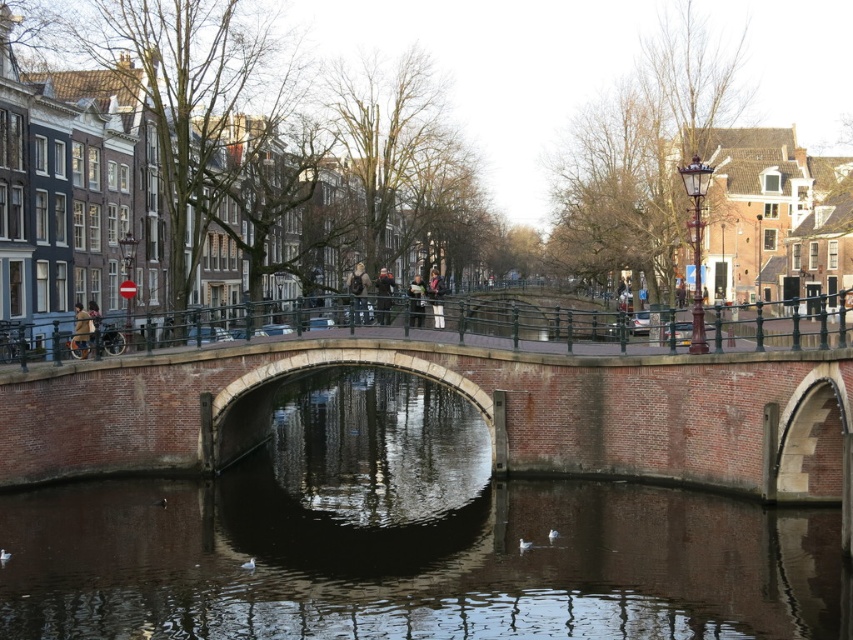
You are a tourist standing on the brick stone bridge at center and want to take a photo of the green metal railing at center. Which object should you focus on first if you want to include both in your photo without moving your camera?

Since the brick stone bridge at center is smaller in size compared to the green metal railing at center, you should focus on the brick stone bridge at center first to ensure it fits within the frame before adjusting for the larger railing.

You are standing at the center of the brick stone bridge at center. You want to walk to the point marked at coordinate 0.625, 0.549. Is that your current location?

Yes, because the brick stone bridge at center is already positioned at point (467, 400).